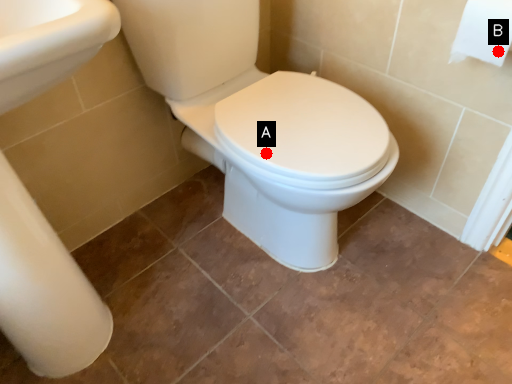
Question: Two points are circled on the image, labeled by A and B beside each circle. Which of the following is the closest to the observer?

Choices:
 (A) A is closer
 (B) B is closer

Answer: (B)